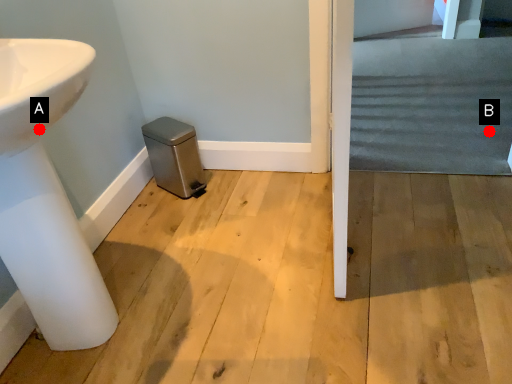
Question: Two points are circled on the image, labeled by A and B beside each circle. Which point is closer to the camera?

Choices:
 (A) A is closer
 (B) B is closer

Answer: (A)